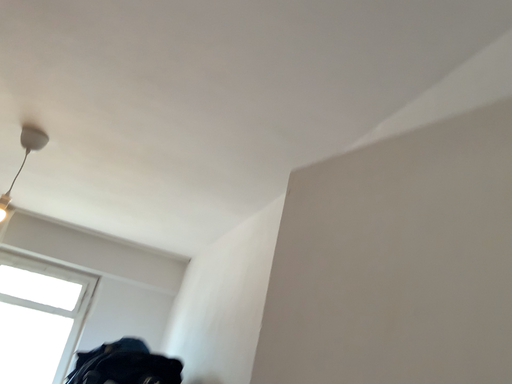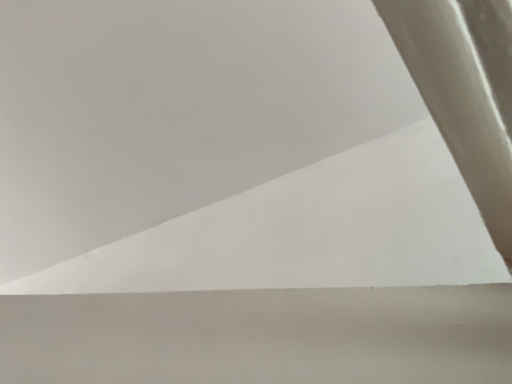
Question: How did the camera likely rotate when shooting the video?

Choices:
 (A) rotated left
 (B) rotated right

Answer: (B)